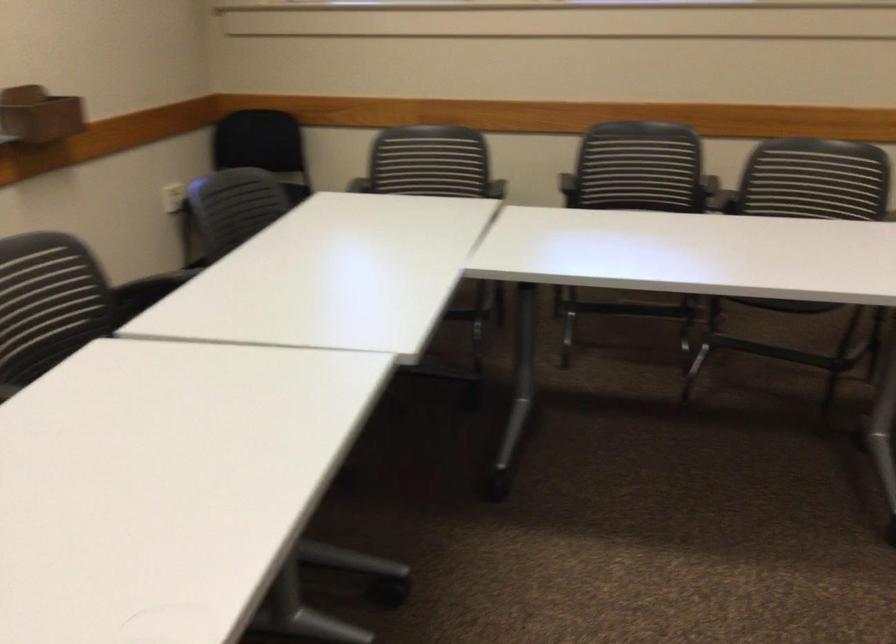
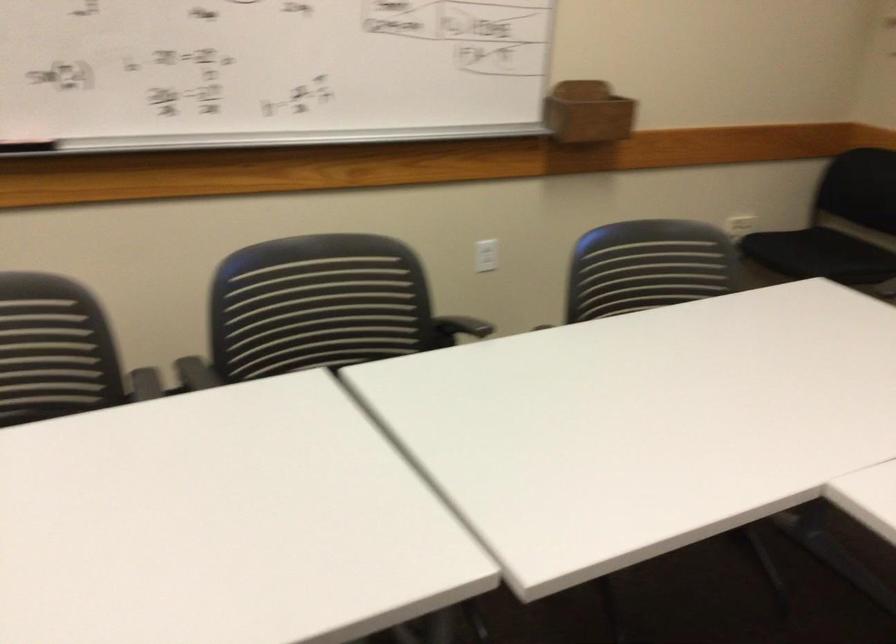
Question: How did the camera likely rotate?

Choices:
 (A) Left
 (B) Right
 (C) Up
 (D) Down

Answer: (A)